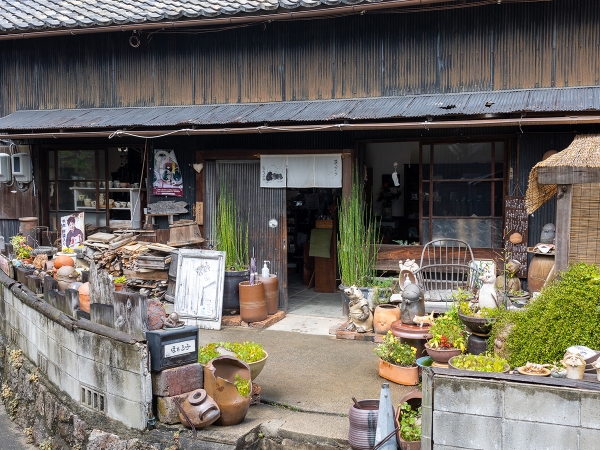
Where is `window`? This screenshot has width=600, height=450. window is located at coordinates (91, 176), (467, 193), (400, 197), (122, 168).